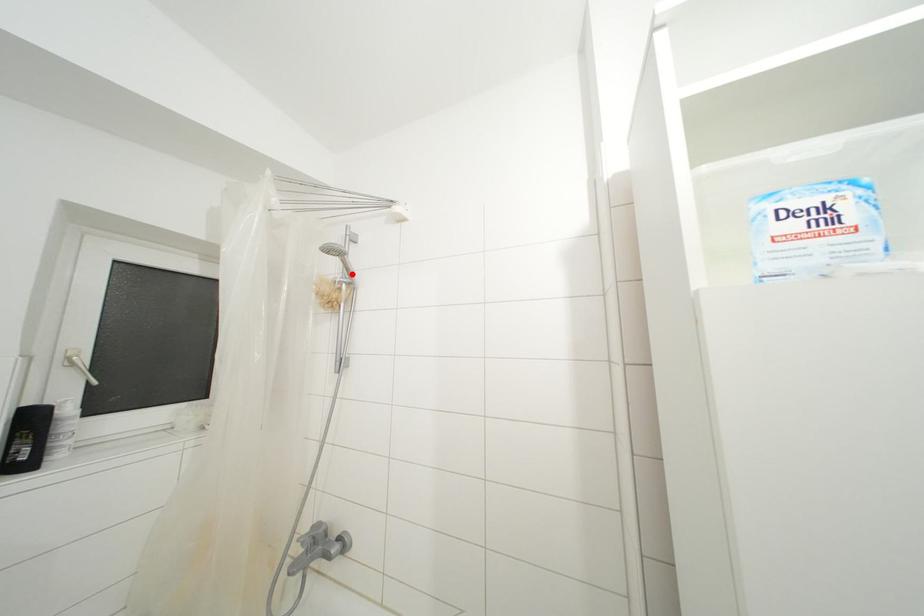
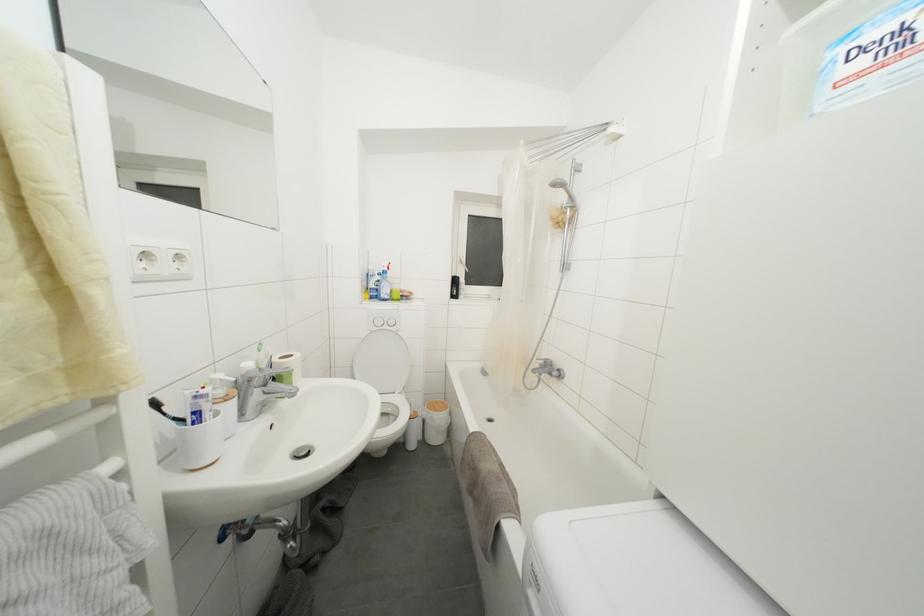
Find the pixel in the second image that matches the highlighted location in the first image.

(575, 200)